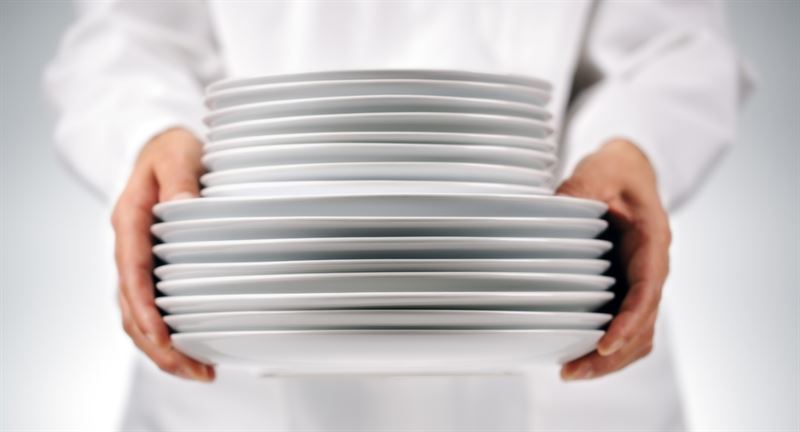
Locate an element on the screen. This screenshot has height=432, width=800. smaller plates is located at coordinates tap(366, 185), tap(364, 167), tap(366, 147), tap(374, 135), tap(384, 119), tap(394, 99), tap(406, 85), tap(418, 72).